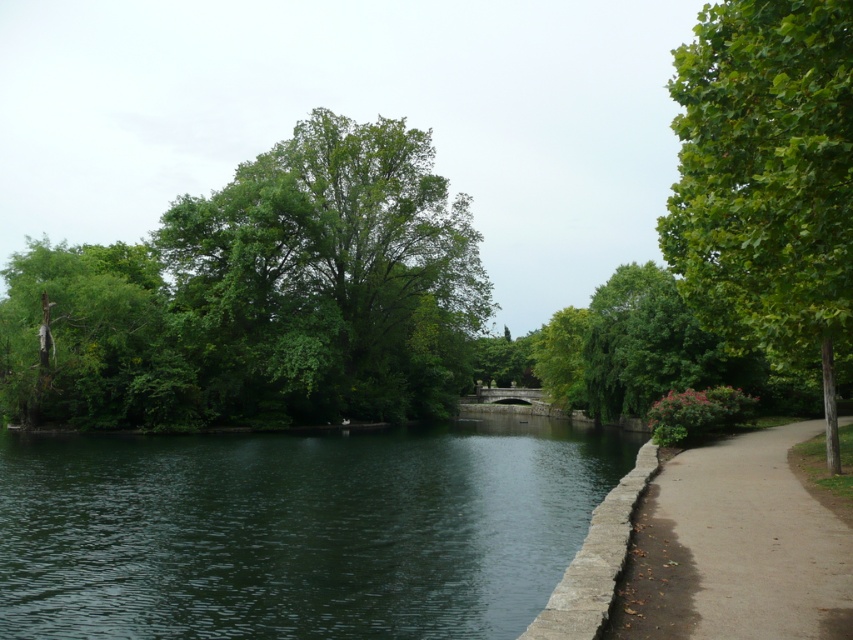
Question: Can you confirm if green leafy tree at right is bigger than concrete sidewalk at right?

Choices:
 (A) no
 (B) yes

Answer: (B)

Question: Which point is closer to the camera taking this photo?

Choices:
 (A) (326, 141)
 (B) (773, 512)
 (C) (457, 538)

Answer: (B)

Question: Can you confirm if dark green water at center is positioned above green leafy tree at right?

Choices:
 (A) yes
 (B) no

Answer: (B)

Question: Observing the image, what is the correct spatial positioning of dark green water at center in reference to green leafy tree at center?

Choices:
 (A) left
 (B) right

Answer: (B)

Question: Which of the following is the closest to the observer?

Choices:
 (A) concrete sidewalk at right
 (B) green leafy tree at center

Answer: (A)

Question: Which point is farther from the camera taking this photo?

Choices:
 (A) (704, 488)
 (B) (688, 54)

Answer: (A)